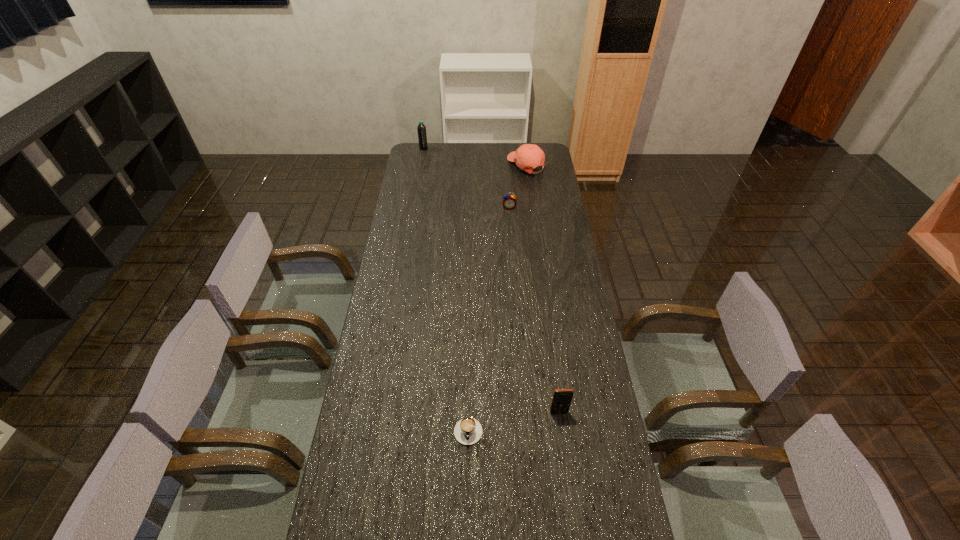
I want to click on free location located 0.280m on the screen of the cellular telephone, so click(572, 513).

Locate an element on the screen. The height and width of the screenshot is (540, 960). vacant space located 0.310m on the front-facing side of the second shortest object is located at coordinates (513, 255).

Where is `vacant space located 0.180m with the handle on the side of the cappuccino`? vacant space located 0.180m with the handle on the side of the cappuccino is located at coordinates (467, 513).

This screenshot has width=960, height=540. What are the coordinates of `water bottle that is at the far edge` in the screenshot? It's located at pyautogui.click(x=422, y=136).

Where is `baseball cap located in the far edge section of the desktop`? Image resolution: width=960 pixels, height=540 pixels. baseball cap located in the far edge section of the desktop is located at coordinates (528, 156).

Where is `object located at the left edge`? This screenshot has height=540, width=960. object located at the left edge is located at coordinates (422, 136).

Identify the location of baseball cap situated at the right edge. (528, 156).

You are a GUI agent. You are given a task and a screenshot of the screen. Output one action in this format:
    pyautogui.click(x=<x>, y=<y>)
    Task: Click on the cellular telephone that is at the right edge
    The height and width of the screenshot is (540, 960).
    Given the screenshot: What is the action you would take?
    pyautogui.click(x=562, y=398)

Locate an element on the screen. This screenshot has height=540, width=960. object positioned at the far left corner is located at coordinates (422, 136).

Locate an element on the screen. This screenshot has width=960, height=540. object situated at the far right corner is located at coordinates (528, 156).